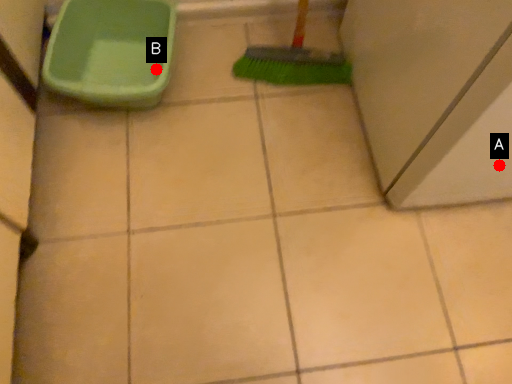
Question: Two points are circled on the image, labeled by A and B beside each circle. Which point appears closest to the camera in this image?

Choices:
 (A) A is closer
 (B) B is closer

Answer: (A)